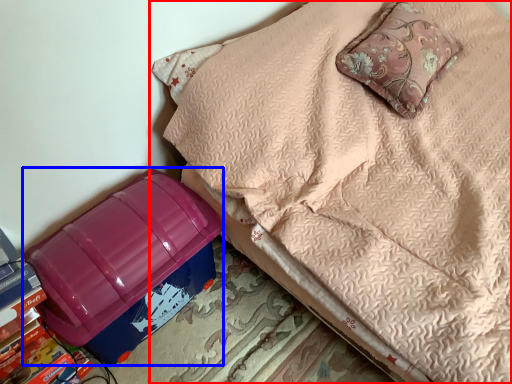
Question: Which object appears farthest to the camera in this image, furniture (highlighted by a red box) or storage box (highlighted by a blue box)?

Choices:
 (A) furniture
 (B) storage box

Answer: (B)